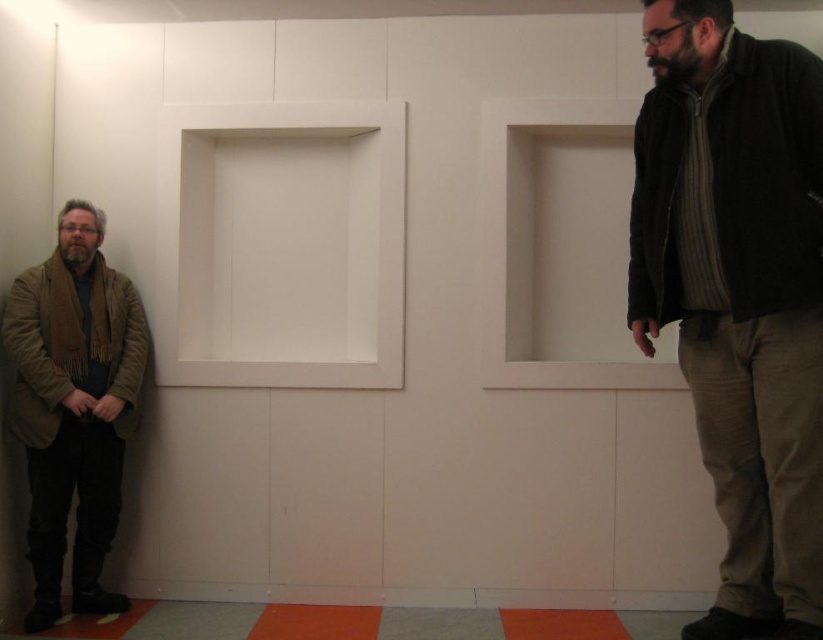
You are standing in a room with two recessed rectangular openings in the wall. You see a dark brown leather jacket at right. Based on its 2D location coordinates, can you determine if the jacket is closer to the left or right recessed opening?

The dark brown leather jacket at right is located at point (x=737, y=294). Since the coordinates are given in a standard 2D plane where the origin is at the bottom left corner, the x and y values range from 0 to 1. The jacket is closer to the right recessed opening because its x coordinate is 0.461, which is closer to the right side of the image compared to the left side.